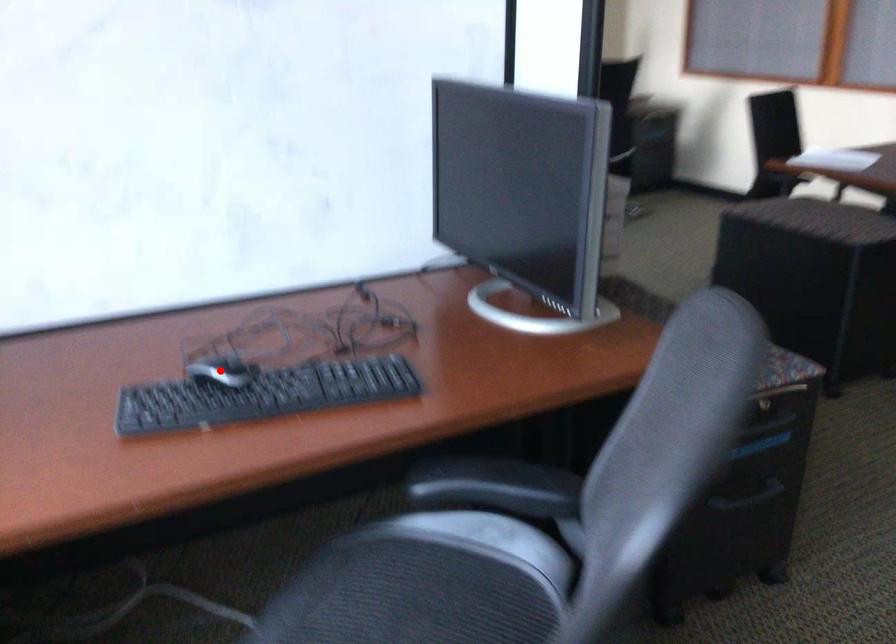
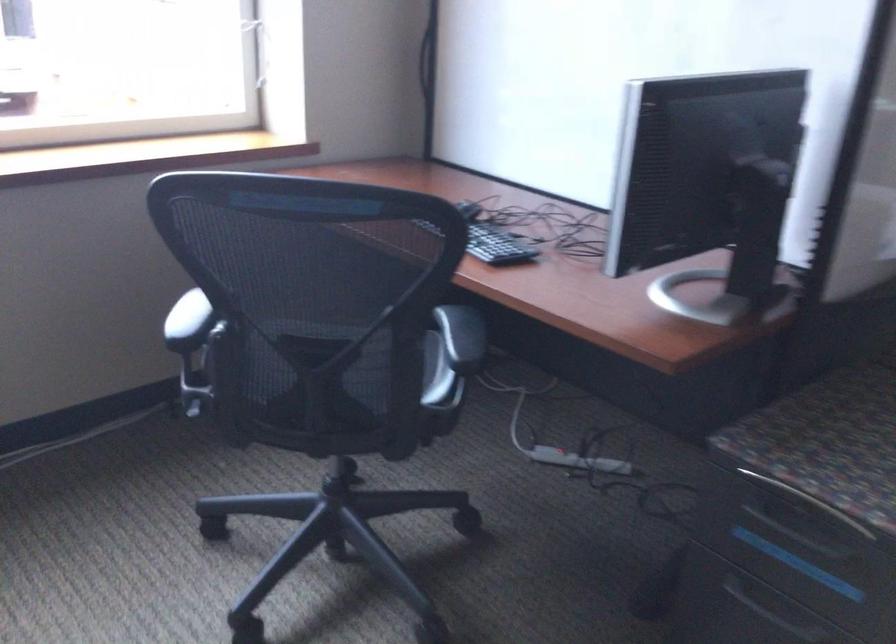
Question: I am providing you with two images of the same scene from different viewpoints. A red point is marked on the first image. Can you still see the location of the red point in image 2?

Choices:
 (A) Yes
 (B) No

Answer: (B)